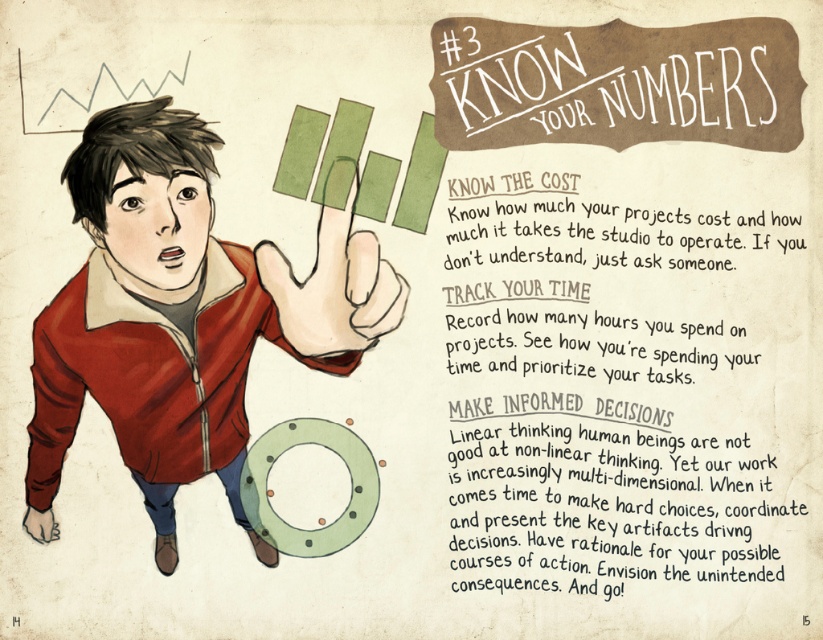
Looking at this image, is brown paper text at upper center bigger than matte red jacket at center?

No.

Does brown paper text at upper center appear on the left side of matte red jacket at center?

Incorrect, brown paper text at upper center is not on the left side of matte red jacket at center.

Between point (575, 189) and point (112, 173), which one is positioned in front?

Point (112, 173) is more forward.

Locate an element on the screen. The width and height of the screenshot is (823, 640). brown paper text at upper center is located at coordinates (615, 378).

Between brown paper text at upper center and green matte horseshoe at lower center, which one has less height?

green matte horseshoe at lower center

Is brown paper text at upper center thinner than green matte horseshoe at lower center?

No, brown paper text at upper center is not thinner than green matte horseshoe at lower center.

Where is `brown paper text at upper center`? The height and width of the screenshot is (640, 823). brown paper text at upper center is located at coordinates (615, 378).

Identify the location of brown paper text at upper center. (615, 378).

Between point (168, 422) and point (286, 272), which one is positioned in front?

Point (168, 422) is in front.

Does matte red jacket at center have a smaller size compared to green matte finger at center?

No.

The height and width of the screenshot is (640, 823). What do you see at coordinates (180, 317) in the screenshot?
I see `matte red jacket at center` at bounding box center [180, 317].

The width and height of the screenshot is (823, 640). Find the location of `matte red jacket at center`. matte red jacket at center is located at coordinates (180, 317).